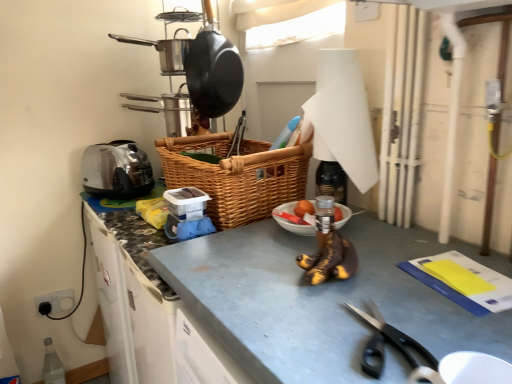
Question: Is satin silver toaster at left at the back of shiny black frying pan at upper center, which appears as the first frying pan when viewed from the left?

Choices:
 (A) yes
 (B) no

Answer: (B)

Question: Considering the relative positions of shiny black frying pan at upper center, which appears as the first frying pan when viewed from the left, and satin silver toaster at left in the image provided, is shiny black frying pan at upper center, which appears as the first frying pan when viewed from the left, to the right of satin silver toaster at left from the viewer's perspective?

Choices:
 (A) yes
 (B) no

Answer: (A)

Question: Can you confirm if shiny black frying pan at upper center, the second frying pan from the right, is taller than satin silver toaster at left?

Choices:
 (A) yes
 (B) no

Answer: (B)

Question: Is shiny black frying pan at upper center, which appears as the first frying pan when viewed from the left, bigger than satin silver toaster at left?

Choices:
 (A) no
 (B) yes

Answer: (A)

Question: Is shiny black frying pan at upper center, which appears as the first frying pan when viewed from the left, positioned far away from satin silver toaster at left?

Choices:
 (A) no
 (B) yes

Answer: (A)

Question: Is satin silver toaster at left completely or partially inside shiny black frying pan at upper center, the second frying pan from the right?

Choices:
 (A) yes
 (B) no

Answer: (B)

Question: Is white paper towel at upper center directly adjacent to satin silver toaster at left?

Choices:
 (A) no
 (B) yes

Answer: (A)

Question: Can you confirm if white paper towel at upper center is shorter than satin silver toaster at left?

Choices:
 (A) yes
 (B) no

Answer: (B)

Question: Is white paper towel at upper center facing towards satin silver toaster at left?

Choices:
 (A) no
 (B) yes

Answer: (A)

Question: Would you consider white paper towel at upper center to be distant from satin silver toaster at left?

Choices:
 (A) yes
 (B) no

Answer: (B)

Question: Is satin silver toaster at left surrounded by white paper towel at upper center?

Choices:
 (A) yes
 (B) no

Answer: (B)

Question: Considering the relative positions of white paper towel at upper center and satin silver toaster at left in the image provided, is white paper towel at upper center to the right of satin silver toaster at left from the viewer's perspective?

Choices:
 (A) no
 (B) yes

Answer: (B)

Question: From a real-world perspective, does black plastic scissors at lower right stand above matte black frying pan at upper center, which appears as the first frying pan when viewed from the right?

Choices:
 (A) yes
 (B) no

Answer: (B)